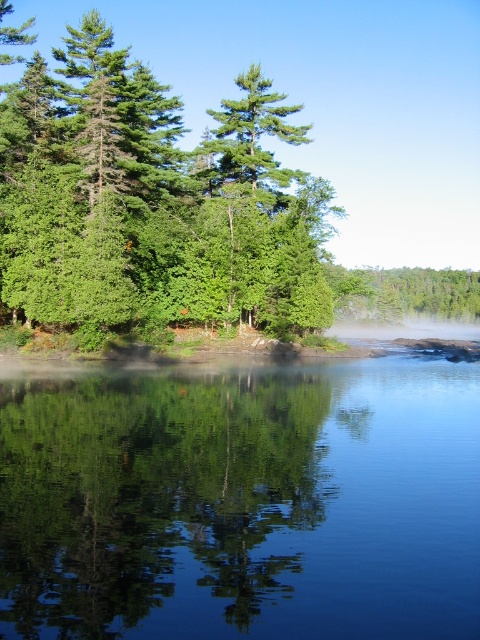
You are an artist trying to paint this landscape. You want to ensure the transparent glass water at center and the green leafy trees at upper left are proportionally accurate. Which object should you paint first if you want to start with the wider one?

The green leafy trees at upper left should be painted first since they are wider than the transparent glass water at center.

You are a bird flying over the landscape. You see the transparent glass water at center and the green leafy trees at upper left. Which object is located higher from the ground?

The green leafy trees at upper left are higher from the ground than the transparent glass water at center because the transparent glass water at center is below the green leafy trees at upper left.

You are standing at the edge of the water in the serene natural landscape. You notice two points marked in the image. Which point, point (116, 547) or point (166, 116), is nearer to your current position?

Point (116, 547) is closer to the camera than point (166, 116), so it is nearer to your current position.